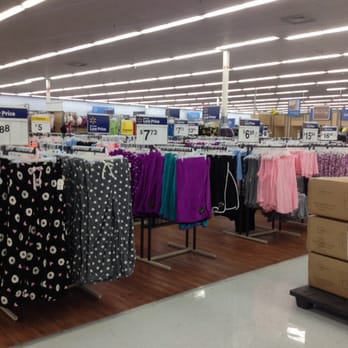
The image size is (348, 348). I want to click on wooden floor, so click(x=237, y=250).